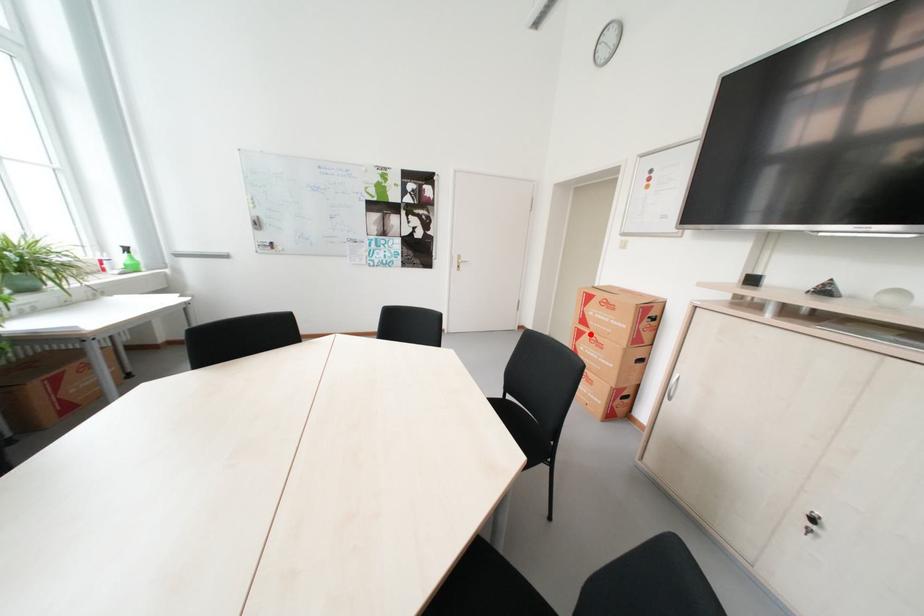
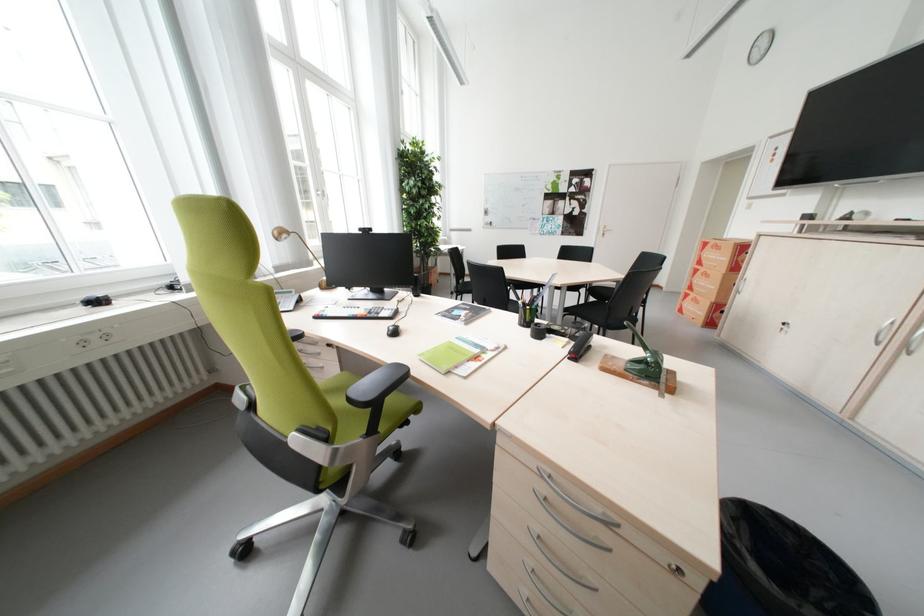
Question: A red point is marked in image1. In image2, is the corresponding 3D point closer to the camera or farther? Reply with the corresponding letter.

Choices:
 (A) The corresponding 3D point is closer.
 (B) The corresponding 3D point is farther.

Answer: (B)